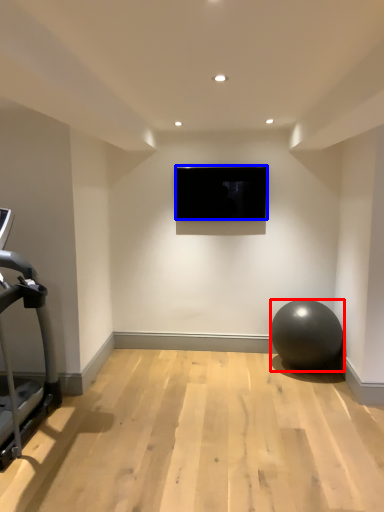
Question: Which object is closer to the camera taking this photo, ball (highlighted by a red box) or television (highlighted by a blue box)?

Choices:
 (A) ball
 (B) television

Answer: (A)